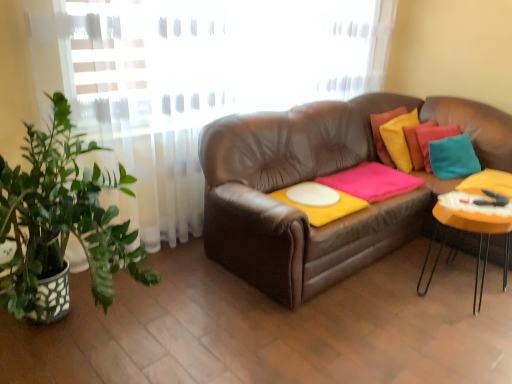
Where is `pink matte blanket at center`? Image resolution: width=512 pixels, height=384 pixels. pink matte blanket at center is located at coordinates (371, 182).

Describe the element at coordinates (470, 231) in the screenshot. I see `orange matte table at right` at that location.

Find the location of `pink matte blanket at center`. pink matte blanket at center is located at coordinates (371, 182).

From the image's perspective, which is above, orange matte table at right or white matte round table at center?

white matte round table at center appears higher in the image.

Between point (460, 227) and point (289, 197), which one is positioned behind?

The point (289, 197) is farther from the camera.

Locate an element on the screen. This screenshot has height=384, width=512. round table that is on the left side of orange matte table at right is located at coordinates (319, 202).

Is point (370, 187) positioned before point (508, 263)?

That is False.

From the picture: Is pink matte blanket at center positioned with its back to orange matte table at right?

No, pink matte blanket at center is not facing away from orange matte table at right.

What's the angular difference between pink matte blanket at center and orange matte table at right's facing directions?

0.835 degrees.

Which object is wider, pink matte blanket at center or orange matte table at right?

pink matte blanket at center.

Considering the positions of objects pink matte blanket at center and white matte round table at center in the image provided, who is in front, pink matte blanket at center or white matte round table at center?

white matte round table at center is in front.

Which of these two, pink matte blanket at center or white matte round table at center, stands taller?

pink matte blanket at center.

Can you tell me how much pink matte blanket at center and white matte round table at center differ in facing direction?

They differ by 0.000494 degrees in their facing directions.

Does pink matte blanket at center appear on the right side of white matte round table at center?

Indeed, pink matte blanket at center is positioned on the right side of white matte round table at center.

From the image's perspective, is white matte round table at center on pink matte blanket at center?

No, from the image's perspective, white matte round table at center is not above pink matte blanket at center.

Can you confirm if white matte round table at center is smaller than pink matte blanket at center?

Yes.

How different are the orientations of white matte round table at center and pink matte blanket at center in degrees?

0.000494 degrees.

Between white matte round table at center and pink matte blanket at center, which one is positioned behind?

pink matte blanket at center is further away from the camera.

How much distance is there between white matte round table at center and orange matte table at right?

white matte round table at center and orange matte table at right are 25.51 inches apart from each other.

Would you say white matte round table at center is a long distance from orange matte table at right?

Actually, white matte round table at center and orange matte table at right are a little close together.

From the image's perspective, which is above, white matte round table at center or orange matte table at right?

white matte round table at center appears higher in the image.

Is white matte round table at center oriented away from orange matte table at right?

No, white matte round table at center's orientation is not away from orange matte table at right.

From the image's perspective, does orange matte table at right appear higher than pink matte blanket at center?

Incorrect, from the image's perspective, orange matte table at right is lower than pink matte blanket at center.

Considering the sizes of objects orange matte table at right and pink matte blanket at center in the image provided, who is bigger, orange matte table at right or pink matte blanket at center?

Bigger between the two is orange matte table at right.

You are a GUI agent. You are given a task and a screenshot of the screen. Output one action in this format:
    pyautogui.click(x=<x>, y=<y>)
    Task: Click on the round table behind the orange matte table at right
    This screenshot has height=384, width=512.
    Given the screenshot: What is the action you would take?
    pyautogui.click(x=319, y=202)

Identify the location of table that appears in front of the pink matte blanket at center. This screenshot has height=384, width=512. (470, 231).

Based on their spatial positions, is pink matte blanket at center or orange matte table at right further from white matte round table at center?

Based on the image, orange matte table at right appears to be further to white matte round table at center.

When comparing their distances from pink matte blanket at center, does white matte round table at center or orange matte table at right seem further?

Among the two, orange matte table at right is located further to pink matte blanket at center.

When comparing their distances from orange matte table at right, does pink matte blanket at center or white matte round table at center seem closer?

The object closer to orange matte table at right is pink matte blanket at center.

Which object lies nearer to the anchor point white matte round table at center, orange matte table at right or pink matte blanket at center?

Among the two, pink matte blanket at center is located nearer to white matte round table at center.

Which object lies nearer to the anchor point pink matte blanket at center, orange matte table at right or white matte round table at center?

The object closer to pink matte blanket at center is white matte round table at center.

Based on their spatial positions, is white matte round table at center or pink matte blanket at center closer to orange matte table at right?

pink matte blanket at center is closer to orange matte table at right.

Find the location of a particular element. The width and height of the screenshot is (512, 384). blanket situated between white matte round table at center and orange matte table at right from left to right is located at coordinates (371, 182).